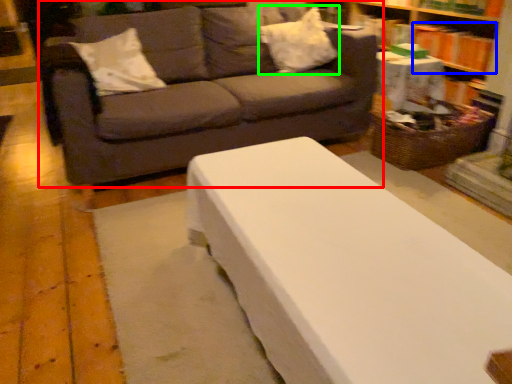
Question: Based on their relative distances, which object is farther from studio couch (highlighted by a red box)? Choose from book (highlighted by a blue box) and pillow (highlighted by a green box).

Choices:
 (A) book
 (B) pillow

Answer: (A)